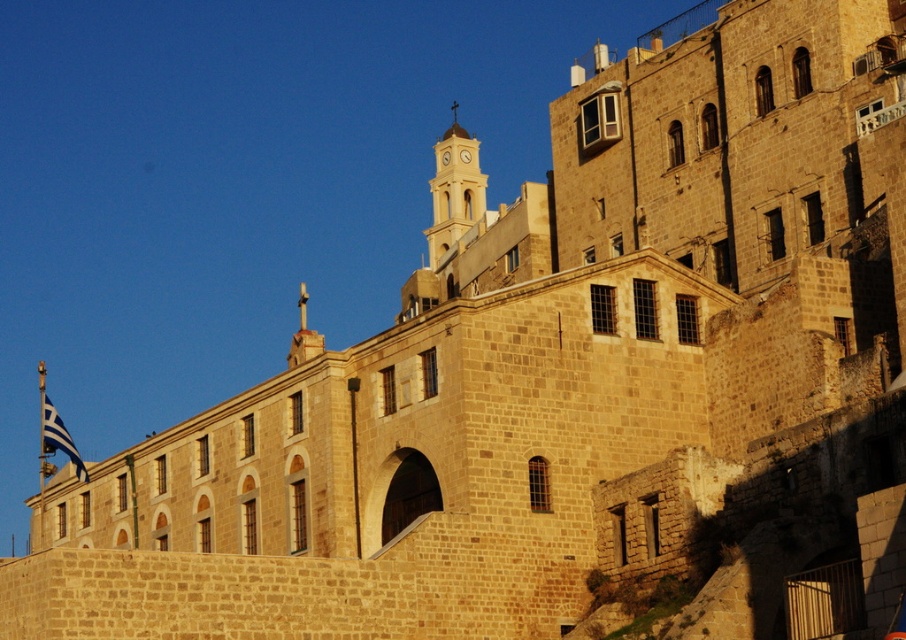
Question: Is light brown stone clock tower at upper center positioned at the back of blue fabric flag at left?

Choices:
 (A) no
 (B) yes

Answer: (B)

Question: Does light brown stone clock tower at upper center appear over yellow metallic clock at upper center?

Choices:
 (A) no
 (B) yes

Answer: (B)

Question: Does yellow wooden clock at upper center appear under yellow metallic clock at upper center?

Choices:
 (A) yes
 (B) no

Answer: (B)

Question: Among these points, which one is farthest from the camera?

Choices:
 (A) (54, 438)
 (B) (447, 150)
 (C) (431, 180)

Answer: (C)

Question: Estimate the real-world distances between objects in this image. Which object is closer to the yellow wooden clock at upper center?

Choices:
 (A) blue fabric flag at left
 (B) yellow metallic clock at upper center

Answer: (B)

Question: Which of the following is the closest to the observer?

Choices:
 (A) (444, 154)
 (B) (85, 472)
 (C) (476, 205)

Answer: (B)